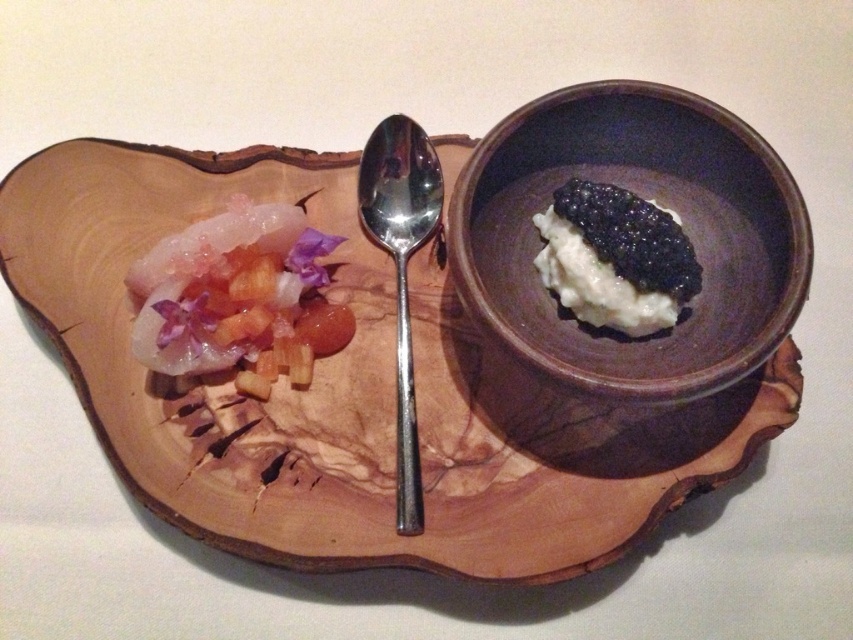
You are a chef arranging ingredients on a rustic wooden serving board. You have two points marked on the board at coordinates point (589, 128) and point (238, 218). Which point is closer to you when you are standing in front of the board?

Point (589, 128) is further to the viewer than point (238, 218), so point (238, 218) is closer to you.

You are arranging items on a rustic wooden board and have the brown matte bowl at center and the translucent gelatinous at left. According to the scene, where should you place the brown matte bowl relative to the translucent gelatinous?

The brown matte bowl at center should be placed to the right of the translucent gelatinous at left.

You are a food critic who wants to taste the black glossy caviar at center first. Which direction should you move your spoon from the translucent gelatinous at left to reach it?

You should move your spoon to the right from the translucent gelatinous at left to reach the black glossy caviar at center since the translucent gelatinous at left is located to the left of black glossy caviar at center.